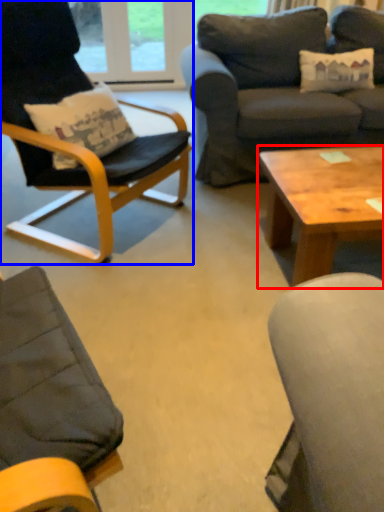
Question: Among these objects, which one is farthest to the camera, coffee table (highlighted by a red box) or chair (highlighted by a blue box)?

Choices:
 (A) coffee table
 (B) chair

Answer: (A)